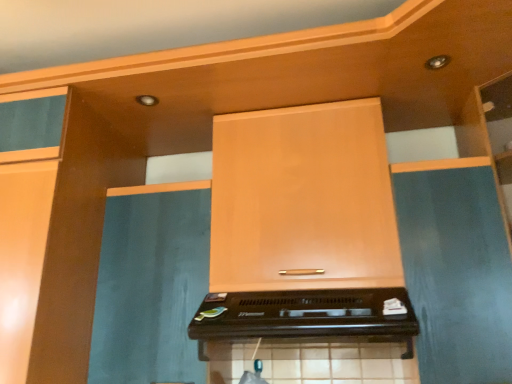
Question: Would you say matte wood cabinet at center contains black plastic toaster at center?

Choices:
 (A) no
 (B) yes

Answer: (A)

Question: Does matte wood cabinet at center have a lesser width compared to black plastic toaster at center?

Choices:
 (A) yes
 (B) no

Answer: (A)

Question: Can you confirm if matte wood cabinet at center is positioned to the right of black plastic toaster at center?

Choices:
 (A) no
 (B) yes

Answer: (B)

Question: From a real-world perspective, is matte wood cabinet at center on top of black plastic toaster at center?

Choices:
 (A) no
 (B) yes

Answer: (B)

Question: Would you say matte wood cabinet at center is outside black plastic toaster at center?

Choices:
 (A) no
 (B) yes

Answer: (B)

Question: Is matte wood cabinet at center facing towards black plastic toaster at center?

Choices:
 (A) yes
 (B) no

Answer: (B)

Question: Is black plastic toaster at center to the left of matte wood cabinet at center from the viewer's perspective?

Choices:
 (A) yes
 (B) no

Answer: (A)

Question: From the image's perspective, is black plastic toaster at center below matte wood cabinet at center?

Choices:
 (A) yes
 (B) no

Answer: (A)

Question: Is matte wood cabinet at center located within black plastic toaster at center?

Choices:
 (A) yes
 (B) no

Answer: (B)

Question: Is black plastic toaster at center positioned in front of matte wood cabinet at center?

Choices:
 (A) no
 (B) yes

Answer: (B)

Question: Does black plastic toaster at center have a smaller size compared to matte wood cabinet at center?

Choices:
 (A) yes
 (B) no

Answer: (A)

Question: Is black plastic toaster at center thinner than matte wood cabinet at center?

Choices:
 (A) no
 (B) yes

Answer: (A)

Question: In the image, is matte wood cabinet at center on the left side or the right side of black plastic toaster at center?

Choices:
 (A) right
 (B) left

Answer: (A)